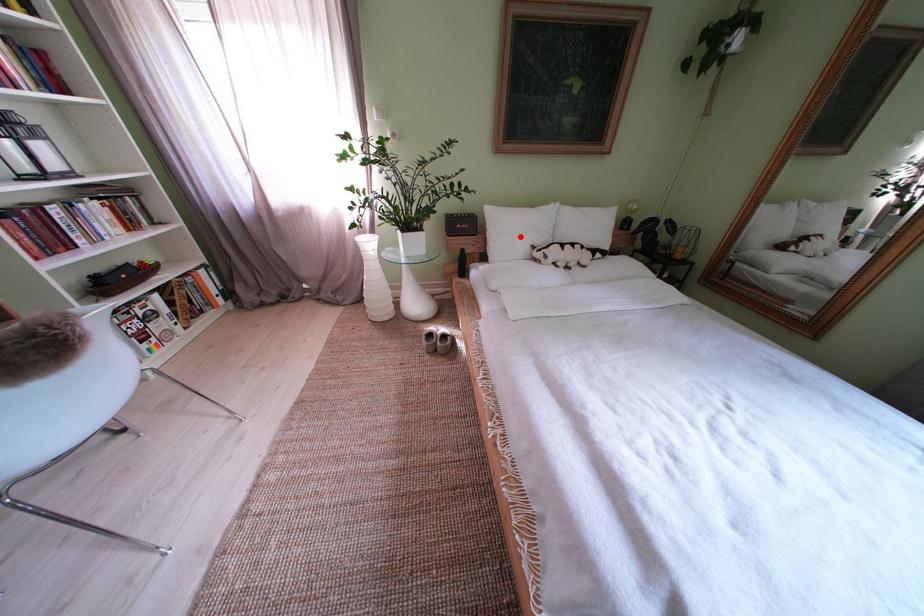
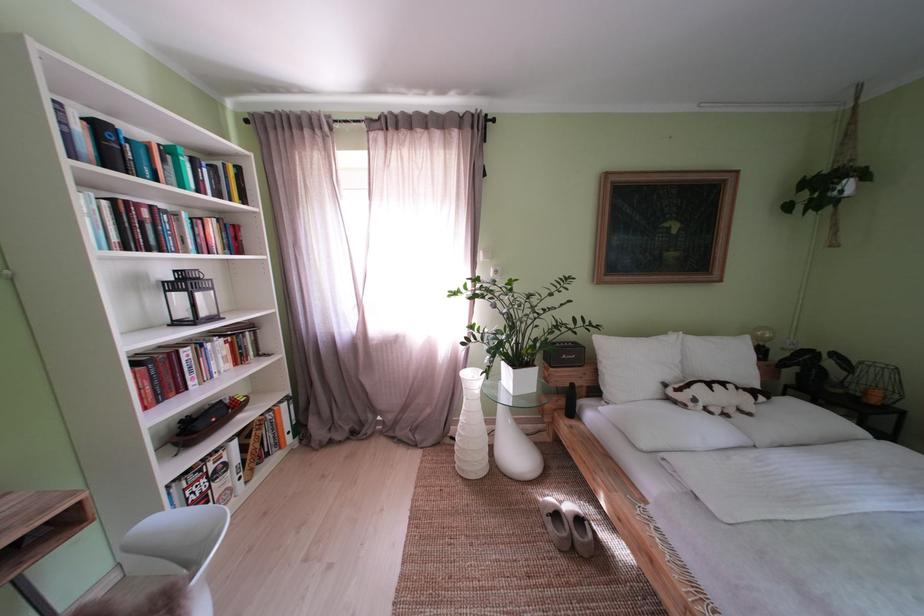
Question: I am providing you with two images of the same scene from different viewpoints. A red point is marked on the first image. Can you still see the location of the red point in image 2?

Choices:
 (A) Yes
 (B) No

Answer: (A)